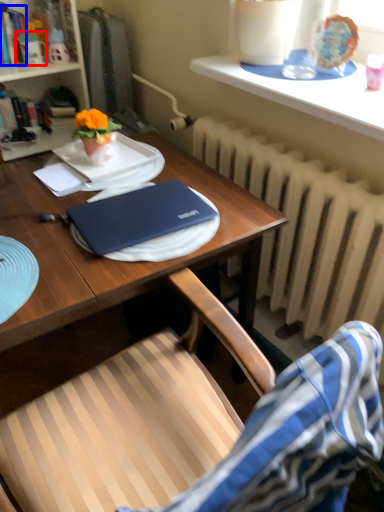
Question: Which of the following is the closest to the observer, toy (highlighted by a red box) or book (highlighted by a blue box)?

Choices:
 (A) toy
 (B) book

Answer: (B)